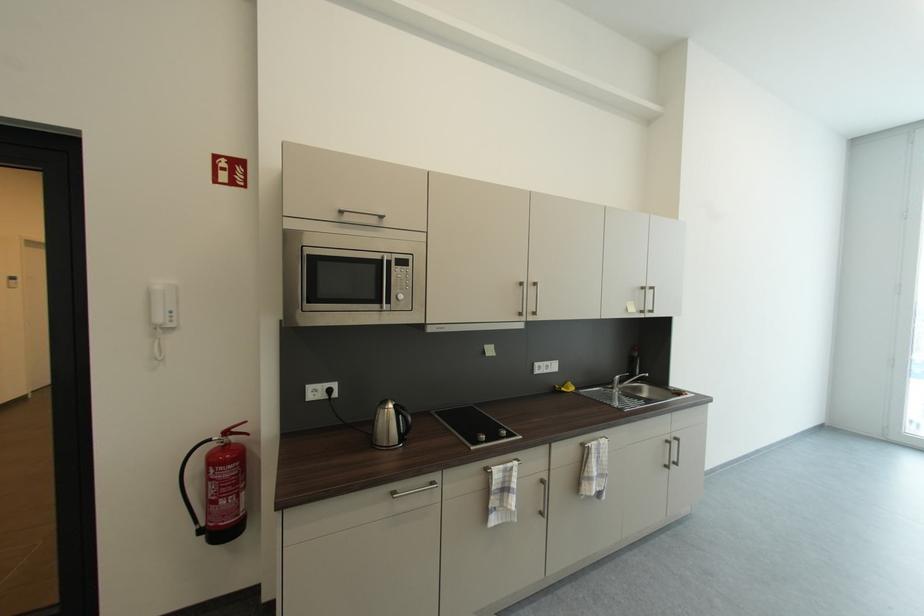
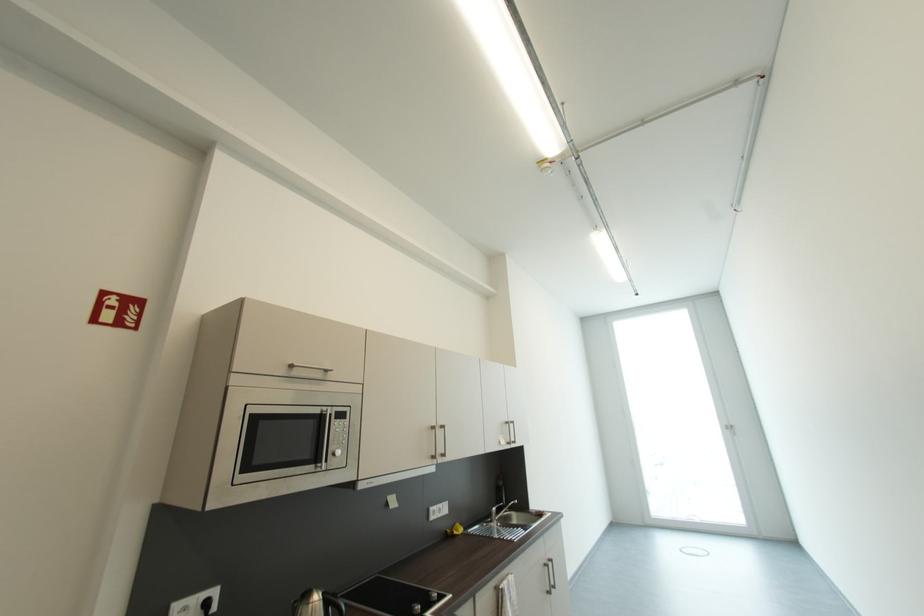
The point at (335,392) is marked in the first image. Where is the corresponding point in the second image?

(213, 605)